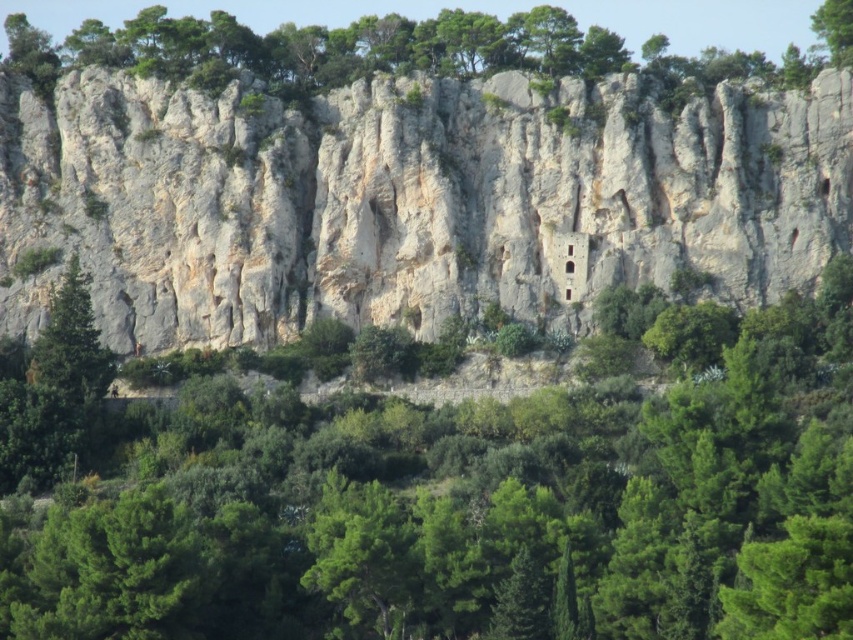
Can you confirm if green leafy tree at center is positioned to the right of green leafy tree at upper right?

Incorrect, green leafy tree at center is not on the right side of green leafy tree at upper right.

Between point (773, 388) and point (848, 13), which one is positioned in front?

Positioned in front is point (773, 388).

Which is in front, point (378, 419) or point (817, 8)?

Point (378, 419) is in front.

I want to click on green leafy tree at center, so click(x=456, y=499).

Who is positioned more to the left, green leafy tree at center or white rock cliff at center?

white rock cliff at center is more to the left.

From the picture: Does green leafy tree at center appear on the right side of white rock cliff at center?

Indeed, green leafy tree at center is positioned on the right side of white rock cliff at center.

Does point (646, 422) lie behind point (419, 116)?

That is False.

Where is `green leafy tree at center`? green leafy tree at center is located at coordinates (456, 499).

Can you confirm if white rock cliff at center is bigger than green leafy tree at upper center?

Actually, white rock cliff at center might be smaller than green leafy tree at upper center.

Does white rock cliff at center appear on the left side of green leafy tree at upper center?

Yes, white rock cliff at center is to the left of green leafy tree at upper center.

Which is in front, point (241, 196) or point (320, 67)?

Positioned in front is point (241, 196).

The height and width of the screenshot is (640, 853). What are the coordinates of `white rock cliff at center` in the screenshot? It's located at (407, 198).